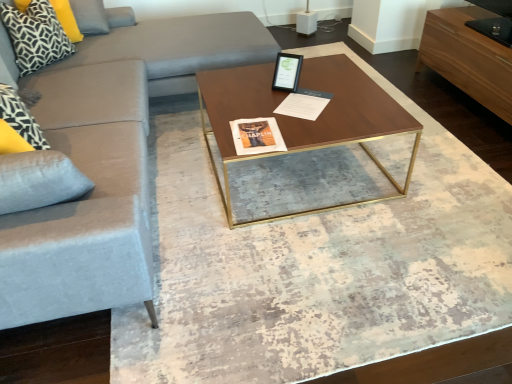
Question: Can you confirm if walnut wood coffee table at center is bigger than black and white geometric pillow at upper left, which appears as the 1th pillow when viewed from the back?

Choices:
 (A) yes
 (B) no

Answer: (A)

Question: From the image's perspective, does walnut wood coffee table at center appear lower than black and white geometric pillow at upper left, which appears as the 1th pillow when viewed from the back?

Choices:
 (A) no
 (B) yes

Answer: (B)

Question: Considering the relative sizes of walnut wood coffee table at center and black and white geometric pillow at upper left, the 2th pillow viewed from the front, in the image provided, is walnut wood coffee table at center wider than black and white geometric pillow at upper left, the 2th pillow viewed from the front,?

Choices:
 (A) no
 (B) yes

Answer: (B)

Question: Does walnut wood coffee table at center have a lesser height compared to black and white geometric pillow at upper left, the 2th pillow viewed from the front?

Choices:
 (A) no
 (B) yes

Answer: (A)

Question: Considering the relative positions of walnut wood coffee table at center and black and white geometric pillow at upper left, which appears as the 1th pillow when viewed from the back, in the image provided, is walnut wood coffee table at center to the left of black and white geometric pillow at upper left, which appears as the 1th pillow when viewed from the back, from the viewer's perspective?

Choices:
 (A) no
 (B) yes

Answer: (A)

Question: Is velvet light gray couch at left inside or outside of walnut wood coffee table at center?

Choices:
 (A) inside
 (B) outside

Answer: (B)

Question: In terms of width, does velvet light gray couch at left look wider or thinner when compared to walnut wood coffee table at center?

Choices:
 (A) wide
 (B) thin

Answer: (A)

Question: In terms of height, does velvet light gray couch at left look taller or shorter compared to walnut wood coffee table at center?

Choices:
 (A) short
 (B) tall

Answer: (B)

Question: Is velvet light gray couch at left bigger or smaller than walnut wood coffee table at center?

Choices:
 (A) big
 (B) small

Answer: (A)

Question: Looking at their shapes, would you say patterned fabric pillow at upper left, which is the first pillow in front-to-back order, is wider or thinner than velvet light gray couch at left?

Choices:
 (A) thin
 (B) wide

Answer: (A)

Question: Is patterned fabric pillow at upper left, which is the first pillow in front-to-back order, situated inside velvet light gray couch at left or outside?

Choices:
 (A) inside
 (B) outside

Answer: (B)

Question: Considering the positions of patterned fabric pillow at upper left, the second pillow from the back, and velvet light gray couch at left in the image, is patterned fabric pillow at upper left, the second pillow from the back, bigger or smaller than velvet light gray couch at left?

Choices:
 (A) big
 (B) small

Answer: (B)

Question: Would you say patterned fabric pillow at upper left, which is the first pillow in front-to-back order, is to the left or to the right of velvet light gray couch at left in the picture?

Choices:
 (A) left
 (B) right

Answer: (A)

Question: From the image's perspective, is velvet light gray couch at left located above or below light brown wood drawer at upper right?

Choices:
 (A) below
 (B) above

Answer: (A)

Question: Visually, is velvet light gray couch at left positioned to the left or to the right of light brown wood drawer at upper right?

Choices:
 (A) right
 (B) left

Answer: (B)